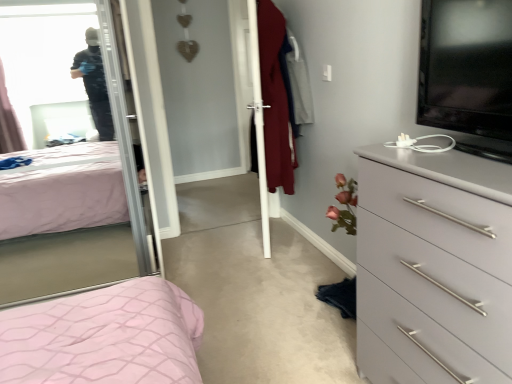
This screenshot has height=384, width=512. Find the location of `free space between white glossy screen door at center and clear glass mirror at upper left`. free space between white glossy screen door at center and clear glass mirror at upper left is located at coordinates coord(212,244).